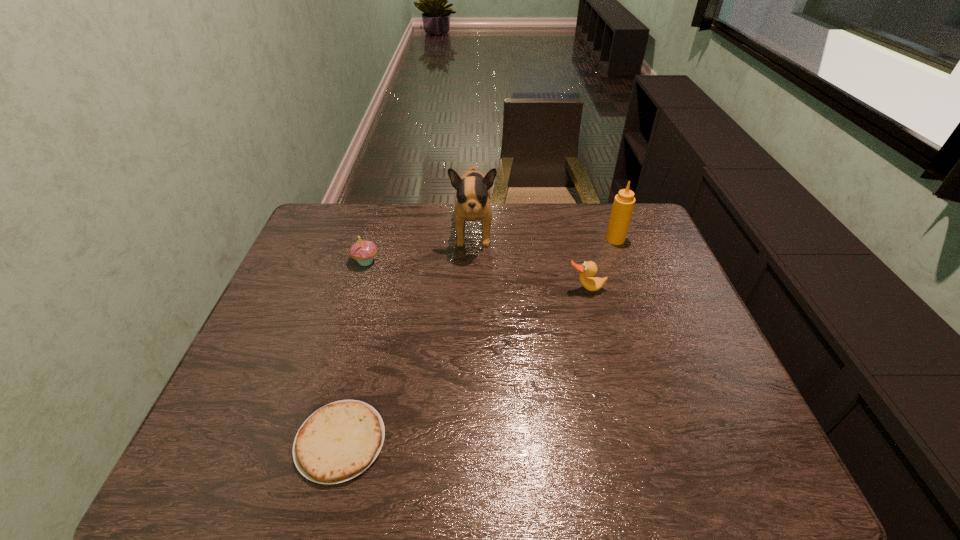
Find the location of a particular element. the tallest object is located at coordinates (473, 194).

At what (x,y) coordinates should I click in order to perform the action: click on the third object from left to right. Please return your answer as a coordinate pair (x, y). The image size is (960, 540). Looking at the image, I should click on (473, 194).

This screenshot has width=960, height=540. Find the location of `the rightmost object`. the rightmost object is located at coordinates (624, 201).

You are a GUI agent. You are given a task and a screenshot of the screen. Output one action in this format:
    pyautogui.click(x=<x>, y=<y>)
    Task: Click on the second tallest object
    Image resolution: width=960 pixels, height=540 pixels.
    Given the screenshot: What is the action you would take?
    pyautogui.click(x=624, y=201)

Where is `cupcake`? cupcake is located at coordinates (363, 251).

This screenshot has width=960, height=540. I want to click on the second object from right to left, so click(x=588, y=269).

Where is `the fourth farthest object`? This screenshot has width=960, height=540. the fourth farthest object is located at coordinates tap(588, 269).

You are a GUI agent. You are given a task and a screenshot of the screen. Output one action in this format:
    pyautogui.click(x=<x>, y=<y>)
    Task: Click on the shortest object
    This screenshot has width=960, height=540.
    Given the screenshot: What is the action you would take?
    pyautogui.click(x=339, y=441)

Identify the location of the nearest object. [339, 441].

Image resolution: width=960 pixels, height=540 pixels. I want to click on vacant space located 0.270m at the face of the third object from right to left, so click(x=471, y=325).